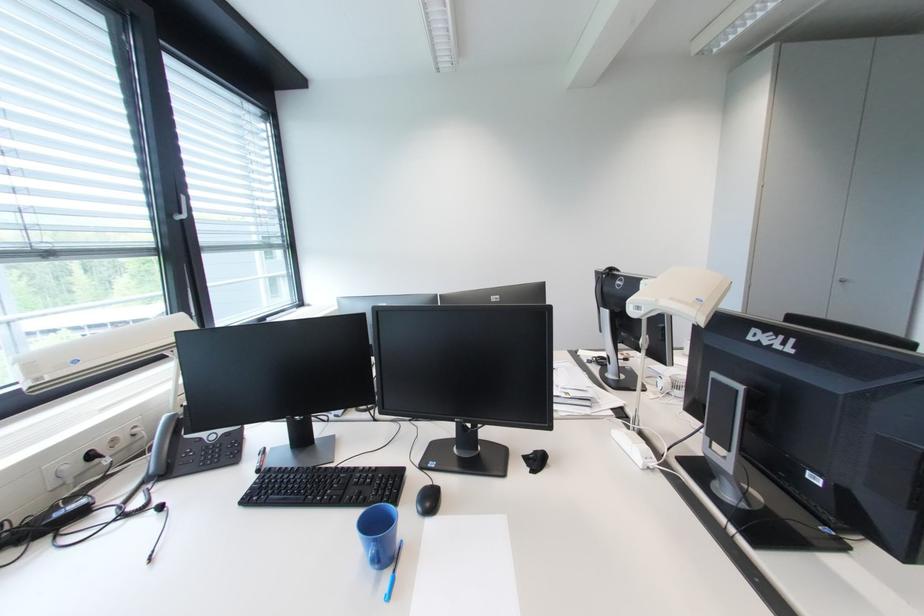
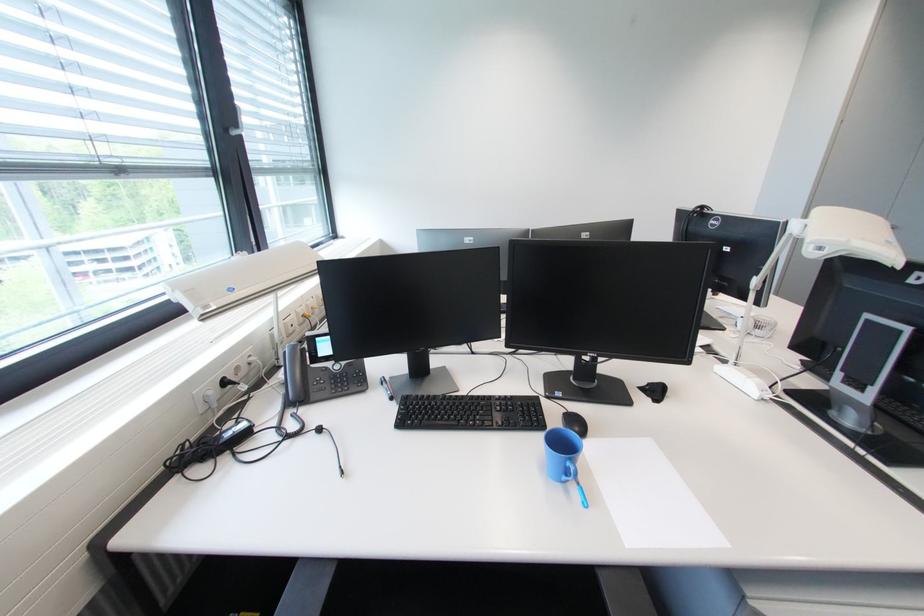
Find the pixel in the second image that matches point (383, 469) in the first image.

(517, 398)